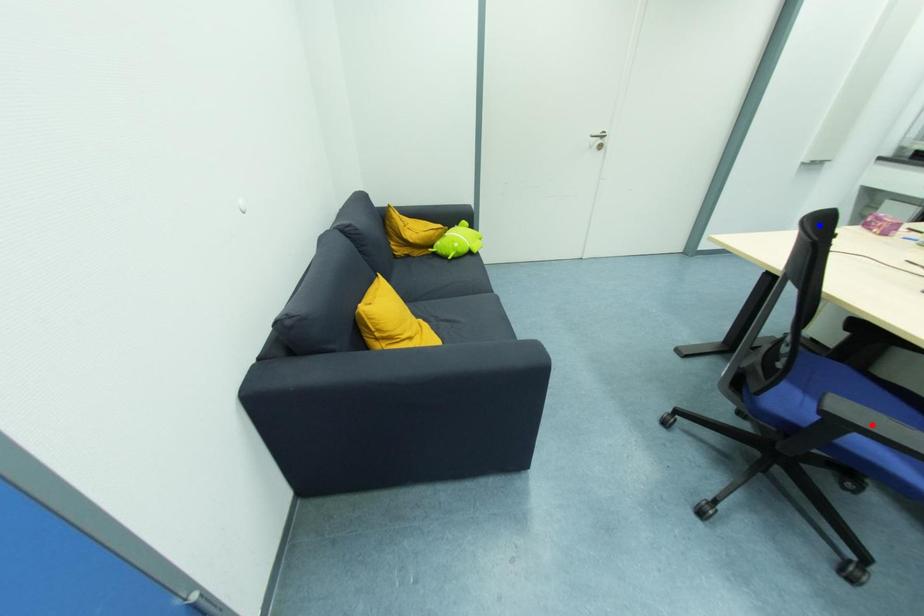
Question: Two points are marked on the image. Which point is closer to the camera?

Choices:
 (A) Blue point is closer.
 (B) Red point is closer.

Answer: (B)